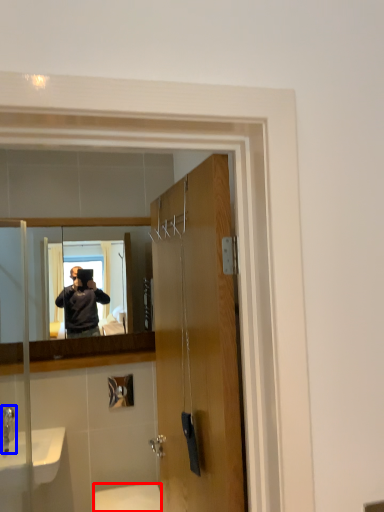
Question: Among these objects, which one is nearest to the camera, toilet (highlighted by a red box) or faucet (highlighted by a blue box)?

Choices:
 (A) toilet
 (B) faucet

Answer: (A)